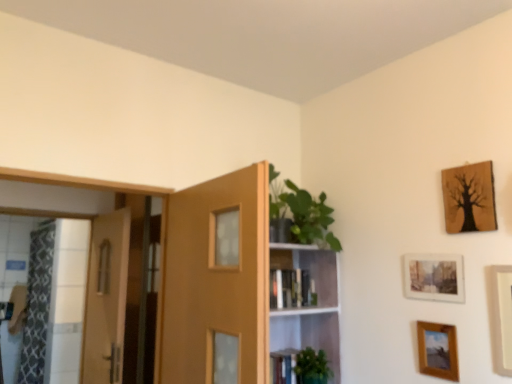
This screenshot has height=384, width=512. I want to click on wooden tree art at upper right, the first picture frame in the top-to-bottom sequence, so click(x=469, y=198).

What do you see at coordinates (106, 298) in the screenshot? The width and height of the screenshot is (512, 384). I see `wooden door at left, marked as the 1th door in a back-to-front arrangement` at bounding box center [106, 298].

The image size is (512, 384). What do you see at coordinates (142, 288) in the screenshot?
I see `clear glass screen door at left` at bounding box center [142, 288].

Where is `wooden picture frame at lower right, positioned as the 4th picture frame in top-to-bottom order`? This screenshot has width=512, height=384. wooden picture frame at lower right, positioned as the 4th picture frame in top-to-bottom order is located at coordinates (438, 350).

Identify the location of patterned fabric shower curtain at left. This screenshot has width=512, height=384. (38, 307).

Image resolution: width=512 pixels, height=384 pixels. Identify the location of green matte plant at lower center. (312, 367).

Image resolution: width=512 pixels, height=384 pixels. What do you see at coordinates (312, 367) in the screenshot?
I see `green matte plant at lower center` at bounding box center [312, 367].

I want to click on matte wood door at center, which is the 1th door in front-to-back order, so [215, 279].

Measure the distance between matte wood door at center, marked as the second door in a left-to-right arrangement, and camera.

A distance of 4.82 feet exists between matte wood door at center, marked as the second door in a left-to-right arrangement, and camera.

Image resolution: width=512 pixels, height=384 pixels. In order to click on wooden tree art at upper right, the first picture frame in the top-to-bottom sequence in this screenshot , I will do `click(469, 198)`.

Which point is more distant from viewer, (503, 308) or (482, 192)?

The point (482, 192) is farther.

Is white matte picture frame at right, the 3th picture frame when ordered from top to bottom, turned away from wooden tree art at upper right, the first picture frame in the top-to-bottom sequence?

No.

Can you tell me how much white matte picture frame at right, the 3th picture frame when ordered from top to bottom, and wooden tree art at upper right, the 4th picture frame ordered from the bottom, differ in facing direction?

They differ by 0.00277 degrees in their facing directions.

Which of these two, white matte picture frame at right, the 2th picture frame from the bottom, or wooden tree art at upper right, the 4th picture frame ordered from the bottom, is wider?

white matte picture frame at right, the 2th picture frame from the bottom, is wider.

Is matte wood door at center, which is counted as the first door, starting from the right, to the left or to the right of green glossy plant at upper center in the image?

In the image, matte wood door at center, which is counted as the first door, starting from the right, appears on the left side of green glossy plant at upper center.

Does matte wood door at center, which is the 1th door in front-to-back order, come behind green glossy plant at upper center?

No, the depth of matte wood door at center, which is the 1th door in front-to-back order, is less than that of green glossy plant at upper center.

Based on their sizes in the image, would you say matte wood door at center, which is the 1th door in front-to-back order, is bigger or smaller than green glossy plant at upper center?

Clearly, matte wood door at center, which is the 1th door in front-to-back order, is smaller in size than green glossy plant at upper center.

From the image's perspective, which one is positioned lower, matte wood door at center, which is counted as the first door, starting from the right, or green glossy plant at upper center?

green glossy plant at upper center is shown below in the image.

From a real-world perspective, is matte paper picture frame at upper right, which is the 3th picture frame from bottom to top, physically located above or below wooden picture frame at lower right, the 1th picture frame ordered from the bottom?

Clearly, from a real-world perspective, matte paper picture frame at upper right, which is the 3th picture frame from bottom to top, is above wooden picture frame at lower right, the 1th picture frame ordered from the bottom.

Is matte paper picture frame at upper right, which is the 3th picture frame from bottom to top, at the right side of wooden picture frame at lower right, positioned as the 4th picture frame in top-to-bottom order?

Correct, you'll find matte paper picture frame at upper right, which is the 3th picture frame from bottom to top, to the right of wooden picture frame at lower right, positioned as the 4th picture frame in top-to-bottom order.

Considering the sizes of objects matte paper picture frame at upper right, which is the 3th picture frame from bottom to top, and wooden picture frame at lower right, positioned as the 4th picture frame in top-to-bottom order, in the image provided, who is bigger, matte paper picture frame at upper right, which is the 3th picture frame from bottom to top, or wooden picture frame at lower right, positioned as the 4th picture frame in top-to-bottom order,?

Bigger between the two is matte paper picture frame at upper right, which is the 3th picture frame from bottom to top.

What's the angular difference between matte paper picture frame at upper right, placed as the second picture frame when sorted from top to bottom, and wooden picture frame at lower right, positioned as the 4th picture frame in top-to-bottom order,'s facing directions?

There is a 0.00833-degree angle between the facing directions of matte paper picture frame at upper right, placed as the second picture frame when sorted from top to bottom, and wooden picture frame at lower right, positioned as the 4th picture frame in top-to-bottom order.

Considering the sizes of green glossy plant at upper center and white matte picture frame at right, the 3th picture frame when ordered from top to bottom, in the image, is green glossy plant at upper center wider or thinner than white matte picture frame at right, the 3th picture frame when ordered from top to bottom,?

In the image, green glossy plant at upper center appears to be wider than white matte picture frame at right, the 3th picture frame when ordered from top to bottom.

Which is closer to the camera, (315, 311) or (497, 336)?

The point (497, 336) is closer to the camera.

Which of these two, green glossy plant at upper center or white matte picture frame at right, the 3th picture frame when ordered from top to bottom, is smaller?

Smaller between the two is white matte picture frame at right, the 3th picture frame when ordered from top to bottom.

From a real-world perspective, is green glossy plant at upper center physically above white matte picture frame at right, the 2th picture frame from the bottom?

Actually, green glossy plant at upper center is physically below white matte picture frame at right, the 2th picture frame from the bottom, in the real world.

Could you tell me if matte wood door at center, which is counted as the 2th door, starting from the back, is turned towards patterned fabric shower curtain at left?

No, matte wood door at center, which is counted as the 2th door, starting from the back, does not turn towards patterned fabric shower curtain at left.

Does matte wood door at center, which is counted as the first door, starting from the right, lie in front of patterned fabric shower curtain at left?

Yes, matte wood door at center, which is counted as the first door, starting from the right, is in front of patterned fabric shower curtain at left.

Based on the photo, is matte wood door at center, which is the 1th door in front-to-back order, wider or thinner than patterned fabric shower curtain at left?

Considering their sizes, matte wood door at center, which is the 1th door in front-to-back order, looks slimmer than patterned fabric shower curtain at left.

Starting from the patterned fabric shower curtain at left, which door is the 2nd one to the right? Please provide its 2D coordinates.

[(215, 279)]

Considering the positions of objects clear glass screen door at left and wooden picture frame at lower right, positioned as the 4th picture frame in top-to-bottom order, in the image provided, who is behind, clear glass screen door at left or wooden picture frame at lower right, positioned as the 4th picture frame in top-to-bottom order,?

clear glass screen door at left is behind.

From a real-world perspective, between clear glass screen door at left and wooden picture frame at lower right, positioned as the 4th picture frame in top-to-bottom order, who is vertically higher?

From a 3D spatial view, clear glass screen door at left is above.

Is clear glass screen door at left taller than wooden picture frame at lower right, the 1th picture frame ordered from the bottom?

Yes, clear glass screen door at left is taller than wooden picture frame at lower right, the 1th picture frame ordered from the bottom.

Considering the positions of objects clear glass screen door at left and wooden picture frame at lower right, the 1th picture frame ordered from the bottom, in the image provided, who is more to the right, clear glass screen door at left or wooden picture frame at lower right, the 1th picture frame ordered from the bottom,?

Positioned to the right is wooden picture frame at lower right, the 1th picture frame ordered from the bottom.

Which object is more forward, patterned fabric shower curtain at left or clear glass screen door at left?

Positioned in front is clear glass screen door at left.

Is point (46, 267) positioned behind point (159, 222)?

Yes.

Considering the sizes of objects patterned fabric shower curtain at left and clear glass screen door at left in the image provided, who is shorter, patterned fabric shower curtain at left or clear glass screen door at left?

clear glass screen door at left.

Find the location of a particular element. This screenshot has height=384, width=512. the 1st picture frame behind the white matte picture frame at right, the 2th picture frame from the bottom is located at coordinates (469, 198).

At what (x,y) coordinates should I click in order to perform the action: click on shelf to the right of matte wood door at center, which is the 1th door in front-to-back order. Please return your answer as a coordinate pair (x, y). Looking at the image, I should click on (304, 303).

Estimate the real-world distances between objects in this image. Which object is further from green matte plant at lower center, green glossy plant at upper center or matte paper picture frame at upper right, placed as the second picture frame when sorted from top to bottom?

matte paper picture frame at upper right, placed as the second picture frame when sorted from top to bottom.

Based on their spatial positions, is wooden door at left, which ranks as the 2th door in right-to-left order, or clear glass screen door at left further from green glossy plant at upper center?

Among the two, wooden door at left, which ranks as the 2th door in right-to-left order, is located further to green glossy plant at upper center.

When comparing their distances from wooden tree art at upper right, the first picture frame in the top-to-bottom sequence, does hardcover book at center or clear glass screen door at left seem further?

clear glass screen door at left.

Estimate the real-world distances between objects in this image. Which object is closer to clear glass screen door at left, wooden door at left, placed as the 1th door when sorted from left to right, or green glossy plant at upper center?

Among the two, wooden door at left, placed as the 1th door when sorted from left to right, is located nearer to clear glass screen door at left.

Estimate the real-world distances between objects in this image. Which object is further from green matte plant at lower center, white matte picture frame at right, the 3th picture frame when ordered from top to bottom, or green glossy plant at upper center?

The object further to green matte plant at lower center is white matte picture frame at right, the 3th picture frame when ordered from top to bottom.

Considering their positions, is green glossy plant at upper center positioned further to clear glass screen door at left than patterned fabric shower curtain at left?

Among the two, patterned fabric shower curtain at left is located further to clear glass screen door at left.

From the image, which object appears to be farther from wooden picture frame at lower right, positioned as the 4th picture frame in top-to-bottom order, white matte picture frame at right, the 2th picture frame from the bottom, or patterned fabric shower curtain at left?

patterned fabric shower curtain at left is positioned further to the anchor wooden picture frame at lower right, positioned as the 4th picture frame in top-to-bottom order.

Looking at the image, which one is located closer to green glossy plant at upper center, matte wood door at center, which is counted as the first door, starting from the right, or wooden tree art at upper right, the 4th picture frame ordered from the bottom?

matte wood door at center, which is counted as the first door, starting from the right, is closer to green glossy plant at upper center.

You are a GUI agent. You are given a task and a screenshot of the screen. Output one action in this format:
    pyautogui.click(x=<x>, y=<y>)
    Task: Click on the plant between clear glass screen door at left and matte paper picture frame at upper right, placed as the second picture frame when sorted from top to bottom, from left to right
    This screenshot has width=512, height=384.
    Given the screenshot: What is the action you would take?
    pyautogui.click(x=312, y=367)

In order to click on door located between clear glass screen door at left and wooden tree art at upper right, the 4th picture frame ordered from the bottom, in the left-right direction in this screenshot , I will do `click(215, 279)`.

At what (x,y) coordinates should I click in order to perform the action: click on shelf situated between patterned fabric shower curtain at left and wooden tree art at upper right, the first picture frame in the top-to-bottom sequence, from left to right. Please return your answer as a coordinate pair (x, y). Looking at the image, I should click on (304, 303).

The height and width of the screenshot is (384, 512). What are the coordinates of `shelf between patterned fabric shower curtain at left and matte paper picture frame at upper right, placed as the second picture frame when sorted from top to bottom, in the horizontal direction` in the screenshot? It's located at (304, 303).